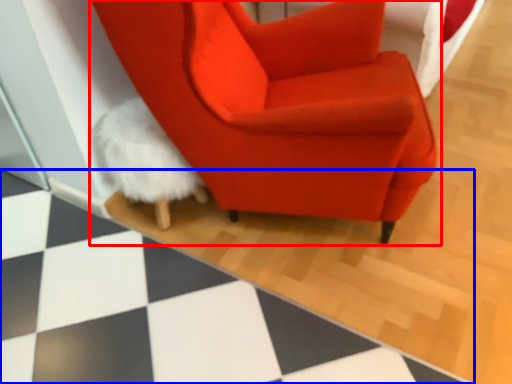
Question: Which of the following is the closest to the observer, chair (highlighted by a red box) or tile (highlighted by a blue box)?

Choices:
 (A) chair
 (B) tile

Answer: (B)